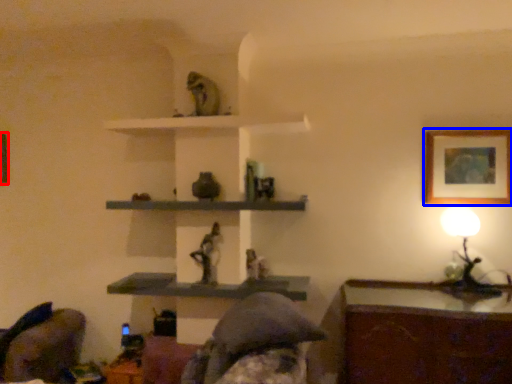
Question: Among these objects, which one is nearest to the camera, picture frame (highlighted by a red box) or picture frame (highlighted by a blue box)?

Choices:
 (A) picture frame
 (B) picture frame

Answer: (B)